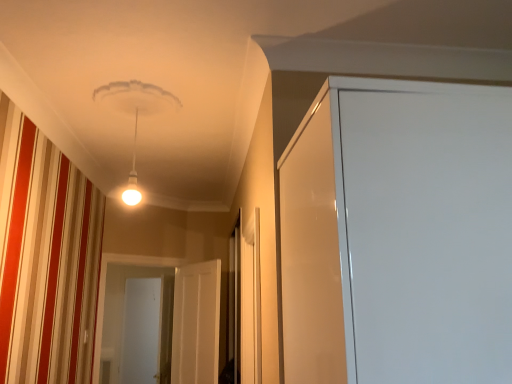
Question: From the image's perspective, is white glossy door at center, acting as the second screen door starting from the left, located above or below white glossy door at center, which ranks as the 1th screen door in front-to-back order?

Choices:
 (A) above
 (B) below

Answer: (A)

Question: From a real-world perspective, is white glossy door at center, acting as the second screen door starting from the left, positioned above or below white glossy door at center, which is the 1th screen door from right to left?

Choices:
 (A) above
 (B) below

Answer: (A)

Question: Estimate the real-world distances between objects in this image. Which object is farther from the white glossy screen door at center, arranged as the third screen door when viewed from the front?

Choices:
 (A) white glossy door at center, placed as the 2th screen door when sorted from back to front
 (B) white glossy door at center, arranged as the 3th screen door when viewed from the back

Answer: (B)

Question: Which is farther from the white glossy door at center, which ranks as the 1th screen door in front-to-back order?

Choices:
 (A) white glossy screen door at center, arranged as the third screen door when viewed from the front
 (B) white glossy door at center, placed as the 2th screen door when sorted from back to front

Answer: (A)